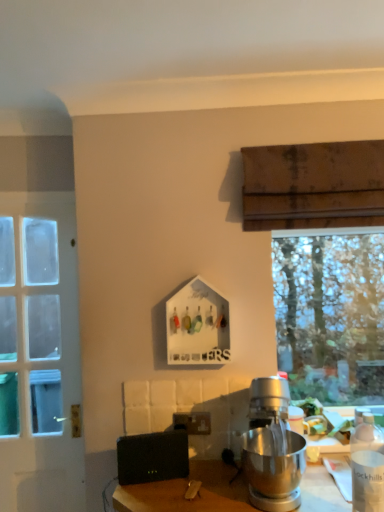
Image resolution: width=384 pixels, height=512 pixels. What do you see at coordinates (193, 422) in the screenshot? I see `matte black power outlet at center` at bounding box center [193, 422].

You are a GUI agent. You are given a task and a screenshot of the screen. Output one action in this format:
    pyautogui.click(x=<x>, y=<y>)
    Task: Click on the white glass door at left
    Image resolution: width=384 pixels, height=512 pixels.
    Given the screenshot: What is the action you would take?
    pyautogui.click(x=39, y=354)

The image size is (384, 512). I want to click on silver metallic stand mixer at center, so click(272, 448).

Image resolution: width=384 pixels, height=512 pixels. Identify the location of matte black power outlet at center. tap(193, 422).

Is white matte bottle at lower right smaller than black matte speaker at lower center?

Incorrect, white matte bottle at lower right is not smaller in size than black matte speaker at lower center.

Could you tell me if white matte bottle at lower right is facing black matte speaker at lower center?

No, white matte bottle at lower right is not oriented towards black matte speaker at lower center.

How many degrees apart are the facing directions of white matte bottle at lower right and black matte speaker at lower center?

They differ by 16.1 degrees in their facing directions.

Locate an element on the screen. Image resolution: width=384 pixels, height=512 pixels. door located behind the silver metallic stand mixer at center is located at coordinates (39, 354).

Is silver metallic stand mixer at center completely or partially inside white glass door at left?

No, silver metallic stand mixer at center is not surrounded by white glass door at left.

Is white glass door at left turned away from silver metallic stand mixer at center?

No, white glass door at left is not facing away from silver metallic stand mixer at center.

Between white glass door at left and silver metallic stand mixer at center, which one appears on the left side from the viewer's perspective?

white glass door at left is more to the left.

From a real-world perspective, is matte black power outlet at center located higher than black matte speaker at lower center?

Yes, from a real-world perspective, matte black power outlet at center is above black matte speaker at lower center.

Between matte black power outlet at center and black matte speaker at lower center, which one has smaller size?

With smaller size is matte black power outlet at center.

How distant is matte black power outlet at center from black matte speaker at lower center?

6.36 inches.

Between matte black power outlet at center and black matte speaker at lower center, which one is positioned behind?

matte black power outlet at center is more distant.

Where is `power outlet that appears below the white matte bottle at lower right (from the image's perspective)`? power outlet that appears below the white matte bottle at lower right (from the image's perspective) is located at coordinates (193, 422).

Does matte black power outlet at center turn towards white matte bottle at lower right?

No, matte black power outlet at center is not aimed at white matte bottle at lower right.

From the image's perspective, which one is positioned lower, matte black power outlet at center or white matte bottle at lower right?

From the image's view, matte black power outlet at center is below.

From a real-world perspective, is matte black power outlet at center physically located above or below white matte bottle at lower right?

Clearly, from a real-world perspective, matte black power outlet at center is below white matte bottle at lower right.

Is matte black power outlet at center taller or shorter than white glass door at left?

Considering their sizes, matte black power outlet at center has less height than white glass door at left.

Identify the location of door on the left of matte black power outlet at center. Image resolution: width=384 pixels, height=512 pixels. (39, 354).

From a real-world perspective, does matte black power outlet at center stand above white glass door at left?

No.

Is matte black power outlet at center far away from white glass door at left?

matte black power outlet at center is near white glass door at left, not far away.

Considering the positions of point (355, 448) and point (261, 441), is point (355, 448) closer or farther from the camera than point (261, 441)?

Point (355, 448) is closer to the camera than point (261, 441).

From a real-world perspective, which is physically above, white matte bottle at lower right or silver metallic stand mixer at center?

silver metallic stand mixer at center, from a real-world perspective.

Is white matte bottle at lower right in contact with silver metallic stand mixer at center?

No, white matte bottle at lower right is not beside silver metallic stand mixer at center.

From the image's perspective, is white matte bottle at lower right on white glass door at left?

No, from the image's perspective, white matte bottle at lower right is not on top of white glass door at left.

Is white matte bottle at lower right positioned behind white glass door at left?

No, the depth of white matte bottle at lower right is less than that of white glass door at left.

Looking at this image, can we say white matte bottle at lower right lies outside white glass door at left?

Yes, white matte bottle at lower right is located beyond the bounds of white glass door at left.

This screenshot has height=512, width=384. Identify the location of bottle on the right of black matte speaker at lower center. (367, 466).

The height and width of the screenshot is (512, 384). Find the location of `door above the silver metallic stand mixer at center (from the image's perspective)`. door above the silver metallic stand mixer at center (from the image's perspective) is located at coordinates (39, 354).

When comparing their distances from silver metallic stand mixer at center, does black matte speaker at lower center or white glass door at left seem further?

white glass door at left.

When comparing their distances from white matte bottle at lower right, does matte black power outlet at center or black matte speaker at lower center seem closer?

Among the two, matte black power outlet at center is located nearer to white matte bottle at lower right.

Based on their spatial positions, is white glass door at left or black matte speaker at lower center closer to white matte bottle at lower right?

Among the two, black matte speaker at lower center is located nearer to white matte bottle at lower right.

Which object lies further to the anchor point black matte speaker at lower center, white glass door at left or white matte bottle at lower right?

Among the two, white matte bottle at lower right is located further to black matte speaker at lower center.

Looking at the image, which one is located closer to silver metallic stand mixer at center, black matte speaker at lower center or white matte bottle at lower right?

The object closer to silver metallic stand mixer at center is white matte bottle at lower right.

Estimate the real-world distances between objects in this image. Which object is further from white glass door at left, black matte speaker at lower center or white matte bottle at lower right?

The object further to white glass door at left is white matte bottle at lower right.

Considering their positions, is white glass door at left positioned further to silver metallic stand mixer at center than white matte bottle at lower right?

white glass door at left lies further to silver metallic stand mixer at center than the other object.

When comparing their distances from white matte bottle at lower right, does silver metallic stand mixer at center or black matte speaker at lower center seem closer?

Based on the image, silver metallic stand mixer at center appears to be nearer to white matte bottle at lower right.

Locate an element on the screen. power outlet between black matte speaker at lower center and white matte bottle at lower right from left to right is located at coordinates (193, 422).

I want to click on appliance between white glass door at left and silver metallic stand mixer at center in the horizontal direction, so click(x=152, y=457).

The image size is (384, 512). Find the location of `kitchen appliance between white matte bottle at lower right and matte black power outlet at center in the front-back direction`. kitchen appliance between white matte bottle at lower right and matte black power outlet at center in the front-back direction is located at coordinates (272, 448).

Locate an element on the screen. The width and height of the screenshot is (384, 512). appliance situated between white glass door at left and matte black power outlet at center from left to right is located at coordinates (152, 457).